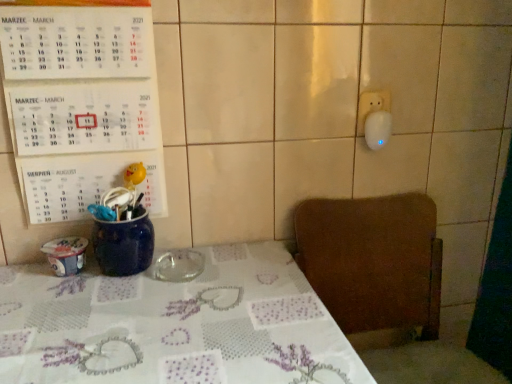
Question: Is white paper calendar at upper left positioned before brown wooden chair at lower right?

Choices:
 (A) yes
 (B) no

Answer: (B)

Question: Is white paper calendar at upper left at the left side of brown wooden chair at lower right?

Choices:
 (A) yes
 (B) no

Answer: (A)

Question: Does white paper calendar at upper left turn towards brown wooden chair at lower right?

Choices:
 (A) no
 (B) yes

Answer: (A)

Question: Are white paper calendar at upper left and brown wooden chair at lower right located far from each other?

Choices:
 (A) yes
 (B) no

Answer: (B)

Question: Can you confirm if white paper calendar at upper left is wider than brown wooden chair at lower right?

Choices:
 (A) yes
 (B) no

Answer: (B)

Question: Can you confirm if white paper calendar at upper left is thinner than brown wooden chair at lower right?

Choices:
 (A) yes
 (B) no

Answer: (A)

Question: Is brown wooden chair at lower right with transparent glass ashtray at center?

Choices:
 (A) yes
 (B) no

Answer: (B)

Question: Does brown wooden chair at lower right lie in front of transparent glass ashtray at center?

Choices:
 (A) yes
 (B) no

Answer: (A)

Question: Considering the relative positions of brown wooden chair at lower right and transparent glass ashtray at center in the image provided, is brown wooden chair at lower right to the right of transparent glass ashtray at center from the viewer's perspective?

Choices:
 (A) no
 (B) yes

Answer: (B)

Question: Is brown wooden chair at lower right shorter than transparent glass ashtray at center?

Choices:
 (A) no
 (B) yes

Answer: (A)

Question: From a real-world perspective, is brown wooden chair at lower right beneath transparent glass ashtray at center?

Choices:
 (A) yes
 (B) no

Answer: (A)

Question: Is brown wooden chair at lower right positioned with its back to transparent glass ashtray at center?

Choices:
 (A) yes
 (B) no

Answer: (B)

Question: Can you confirm if transparent glass ashtray at center is bigger than white paper calendar at upper left?

Choices:
 (A) no
 (B) yes

Answer: (A)